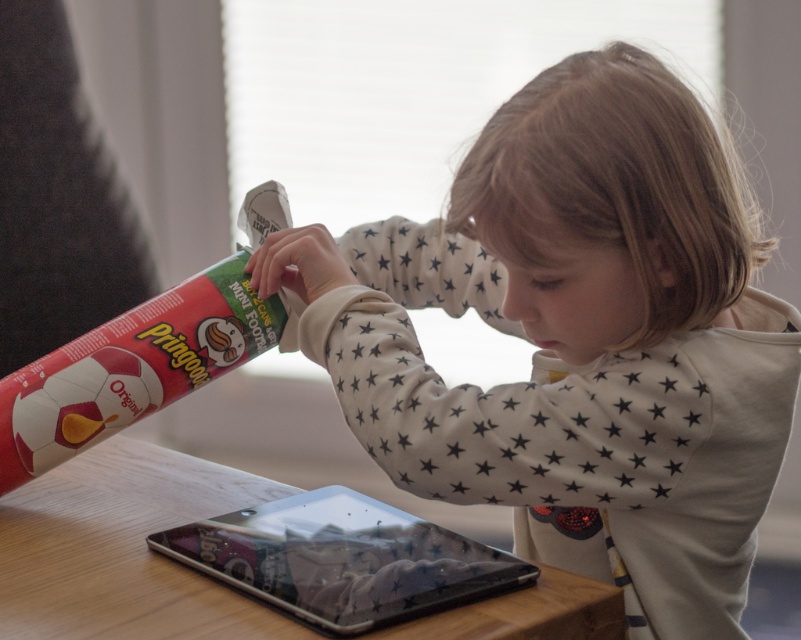
Question: Is matte red pringles can at left to the right of transparent plastic tablet at center from the viewer's perspective?

Choices:
 (A) yes
 (B) no

Answer: (B)

Question: Does wooden table at center appear over matte red pringles can at left?

Choices:
 (A) no
 (B) yes

Answer: (A)

Question: Considering the real-world distances, which object is farthest from the transparent plastic tablet at center?

Choices:
 (A) matte red pringles can at left
 (B) white star-patterned sweater at center

Answer: (A)

Question: Can you confirm if wooden table at center is smaller than transparent plastic tablet at center?

Choices:
 (A) yes
 (B) no

Answer: (B)

Question: Estimate the real-world distances between objects in this image. Which object is farther from the wooden table at center?

Choices:
 (A) white star-patterned sweater at center
 (B) transparent plastic tablet at center

Answer: (A)

Question: Which point is farther to the camera?

Choices:
 (A) white star-patterned sweater at center
 (B) transparent plastic tablet at center
 (C) matte red pringles can at left

Answer: (C)